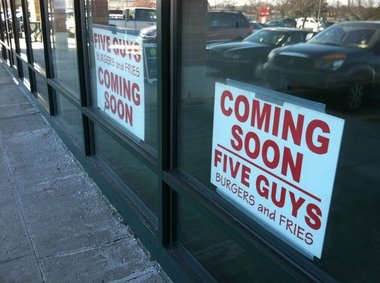
Locate an element on the screen. table is located at coordinates (36, 28).